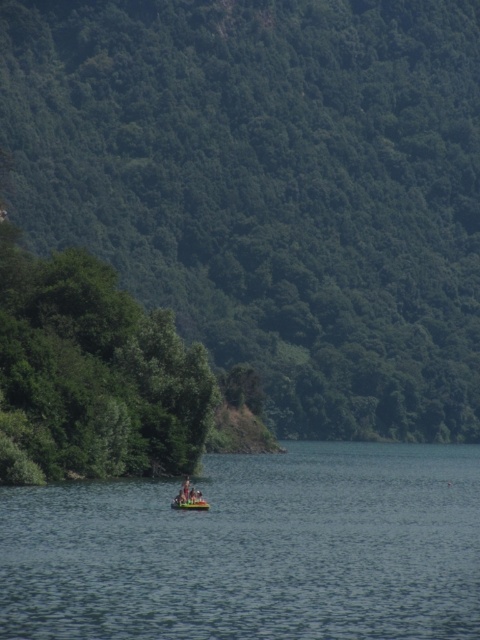
Can you confirm if green leafy tree at left is positioned to the right of yellow rubber boat at center?

Incorrect, green leafy tree at left is not on the right side of yellow rubber boat at center.

Is green leafy tree at left above yellow rubber boat at center?

Yes, green leafy tree at left is above yellow rubber boat at center.

What do you see at coordinates (95, 371) in the screenshot? This screenshot has width=480, height=640. I see `green leafy tree at left` at bounding box center [95, 371].

Where is `green leafy tree at left`? green leafy tree at left is located at coordinates (95, 371).

Based on the photo, is clear blue water at center shorter than green leafy tree at left?

Yes, clear blue water at center is shorter than green leafy tree at left.

Can you confirm if clear blue water at center is bigger than green leafy tree at left?

Indeed, clear blue water at center has a larger size compared to green leafy tree at left.

Is point (61, 509) positioned in front of point (78, 449)?

That is True.

I want to click on clear blue water at center, so click(252, 548).

Who is higher up, green leafy tree at center-left or green leafy tree at left?

green leafy tree at center-left

Between green leafy tree at center-left and green leafy tree at left, which one appears on the right side from the viewer's perspective?

Positioned to the right is green leafy tree at center-left.

The height and width of the screenshot is (640, 480). I want to click on green leafy tree at center-left, so (269, 188).